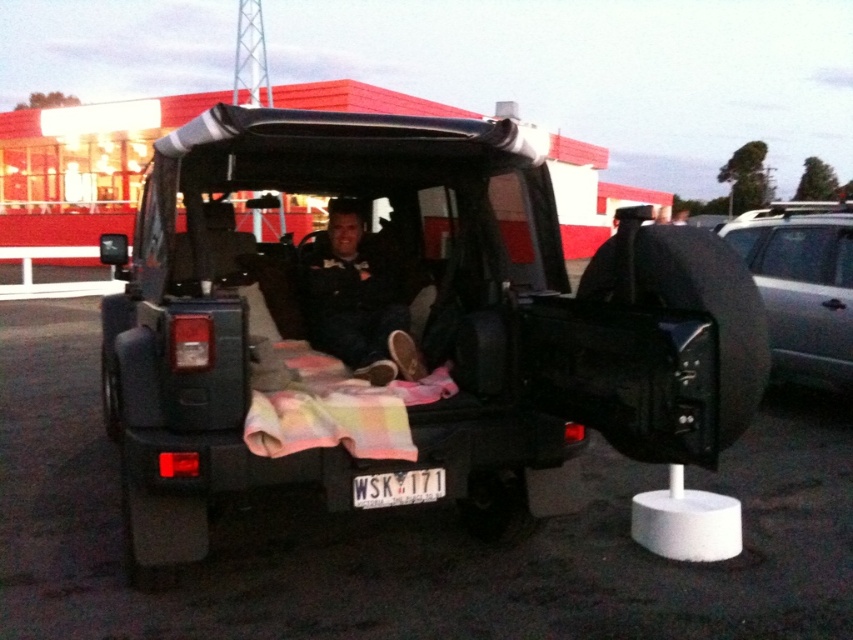
Question: Among these objects, which one is nearest to the camera?

Choices:
 (A) matte black jeep at center
 (B) white plastic license plate at center
 (C) silver metallic suv at right
 (D) matte black jacket at center

Answer: (A)

Question: From the image, what is the correct spatial relationship of matte black jeep at center in relation to matte black jacket at center?

Choices:
 (A) below
 (B) above

Answer: (B)

Question: Which object appears closest to the camera in this image?

Choices:
 (A) white plastic license plate at center
 (B) matte black jacket at center
 (C) matte black jeep at center

Answer: (C)

Question: Is matte black jeep at center to the left of white plastic license plate at center from the viewer's perspective?

Choices:
 (A) yes
 (B) no

Answer: (A)

Question: Which point is closer to the camera?

Choices:
 (A) (398, 484)
 (B) (712, 305)
 (C) (773, 368)

Answer: (B)

Question: Is matte black jeep at center to the left of silver metallic suv at right from the viewer's perspective?

Choices:
 (A) no
 (B) yes

Answer: (B)